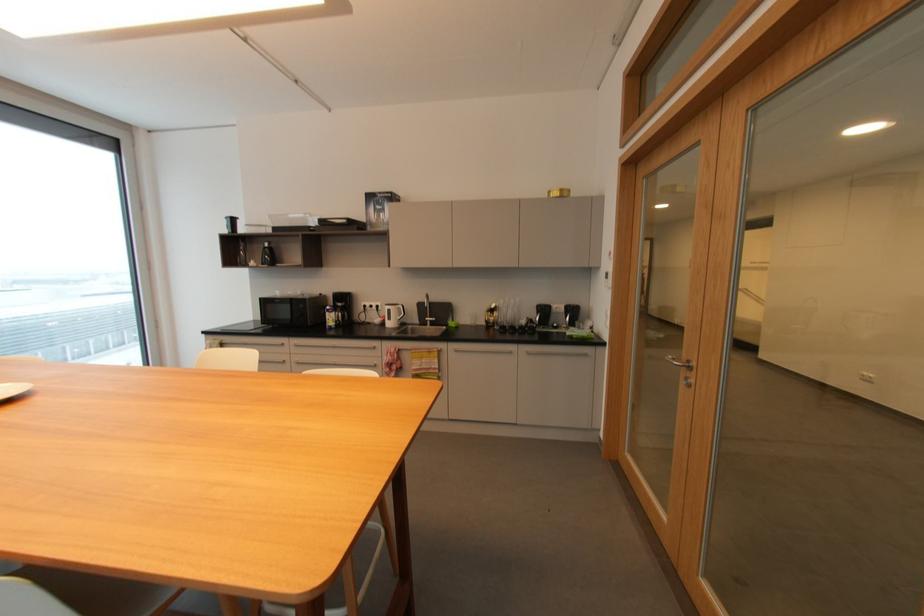
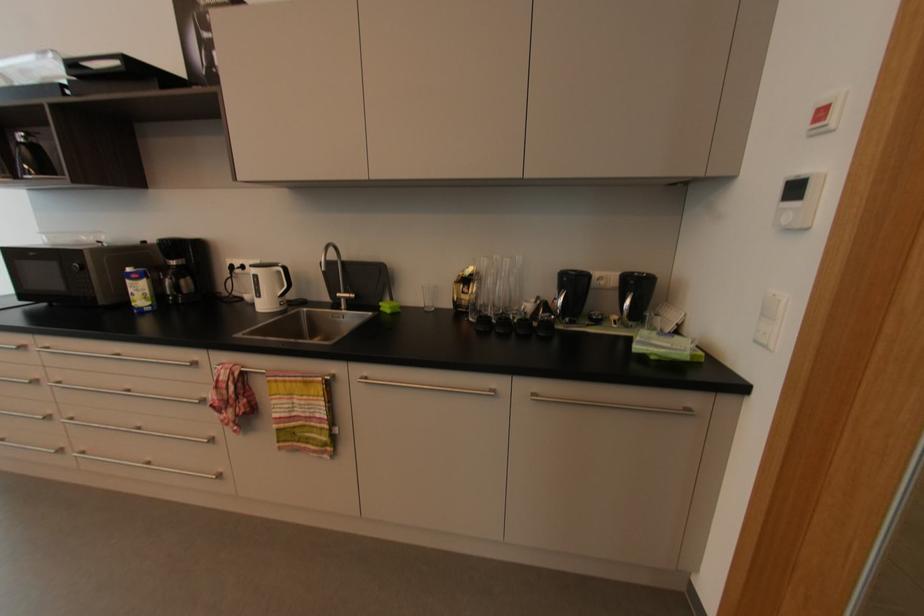
Where in the second image is the point corresponding to the point at 453,326 from the first image?

(384, 309)